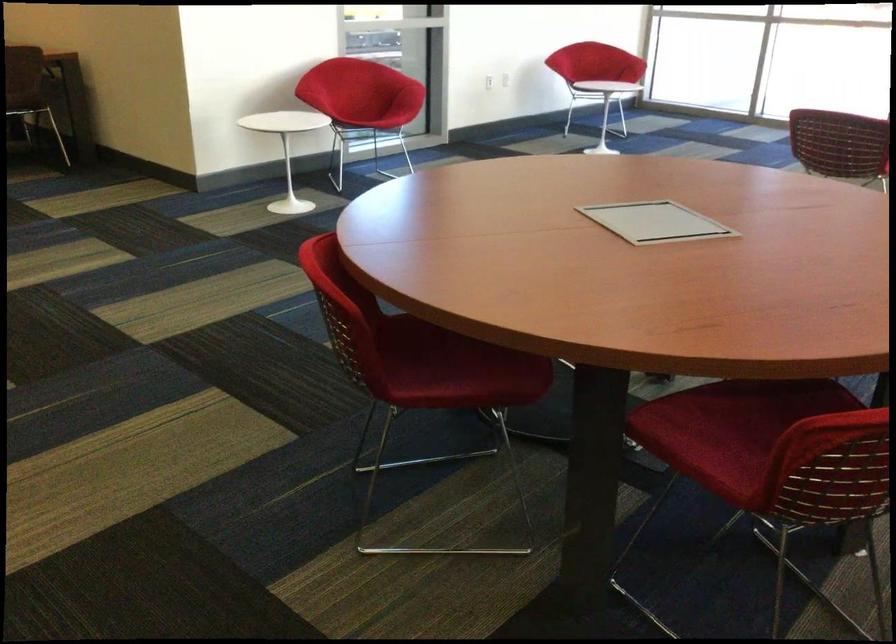
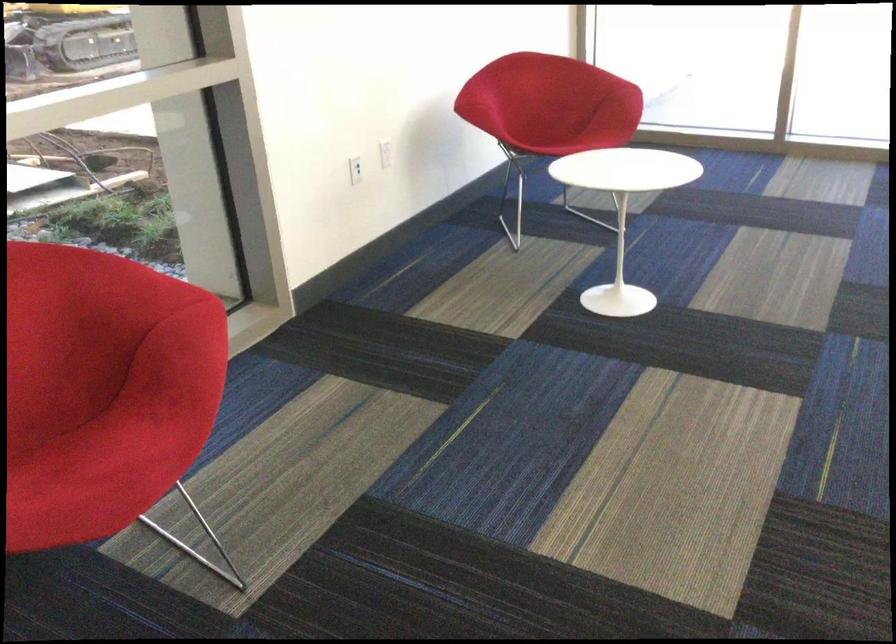
Question: Which direction would the cameraman need to move to produce the second image? Reply with the corresponding letter.

Choices:
 (A) Left
 (B) Right
 (C) Forward
 (D) Backward

Answer: (C)